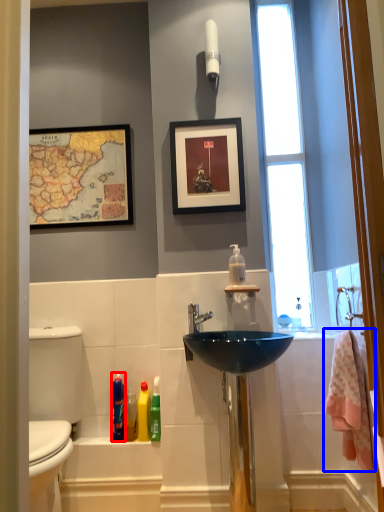
Question: Among these objects, which one is farthest to the camera, cleaning product (highlighted by a red box) or bath towel (highlighted by a blue box)?

Choices:
 (A) cleaning product
 (B) bath towel

Answer: (A)